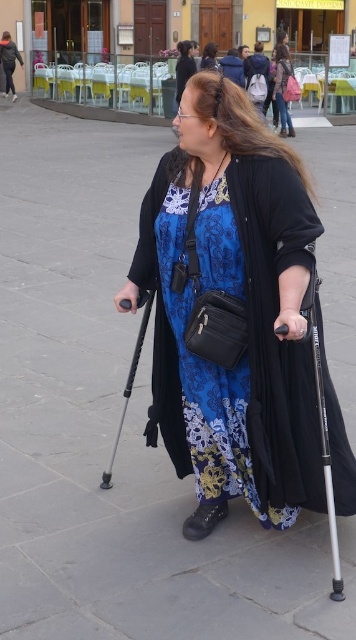
Question: Among these points, which one is farthest from the camera?

Choices:
 (A) (184, 86)
 (B) (288, 58)
 (C) (164, 227)

Answer: (B)

Question: Can you confirm if metallic silver crutch at center is positioned to the right of black matte robe at upper left?

Choices:
 (A) yes
 (B) no

Answer: (A)

Question: Estimate the real-world distances between objects in this image. Which object is farther from the metallic silver crutch at center?

Choices:
 (A) blue floral robe at center
 (B) black matte robe at upper left
 (C) blue floral dress at center
 (D) silver metallic crutch at lower right

Answer: (B)

Question: Among these points, which one is farthest from the camera?

Choices:
 (A) click(x=103, y=477)
 (B) click(x=0, y=40)
 (C) click(x=285, y=353)
 (D) click(x=194, y=72)

Answer: (B)

Question: Is blue floral dress at center to the left of blue floral robe at center from the viewer's perspective?

Choices:
 (A) yes
 (B) no

Answer: (B)

Question: Is silver metallic crutch at lower right below black matte robe at upper left?

Choices:
 (A) yes
 (B) no

Answer: (A)